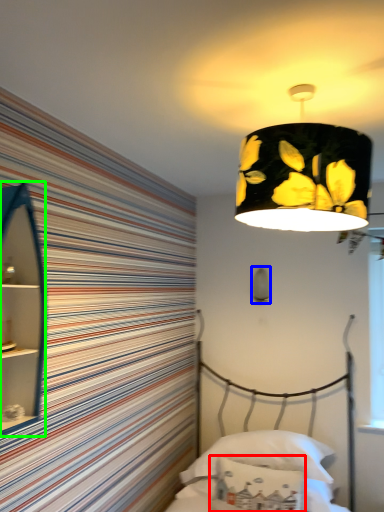
Question: Which object is positioned farthest from pillow (highlighted by a red box)? Select from lamp (highlighted by a blue box) and cabinet (highlighted by a green box).

Choices:
 (A) lamp
 (B) cabinet

Answer: (B)